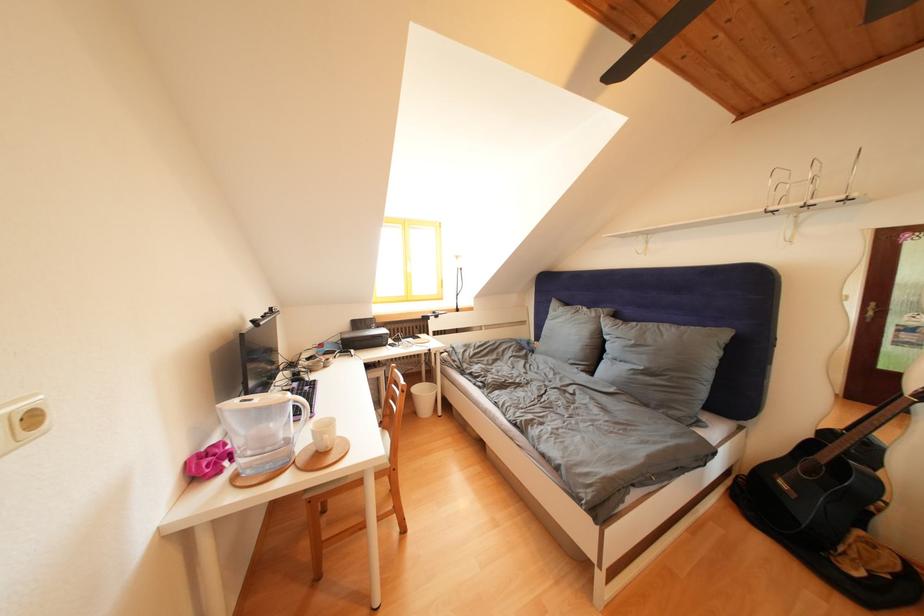
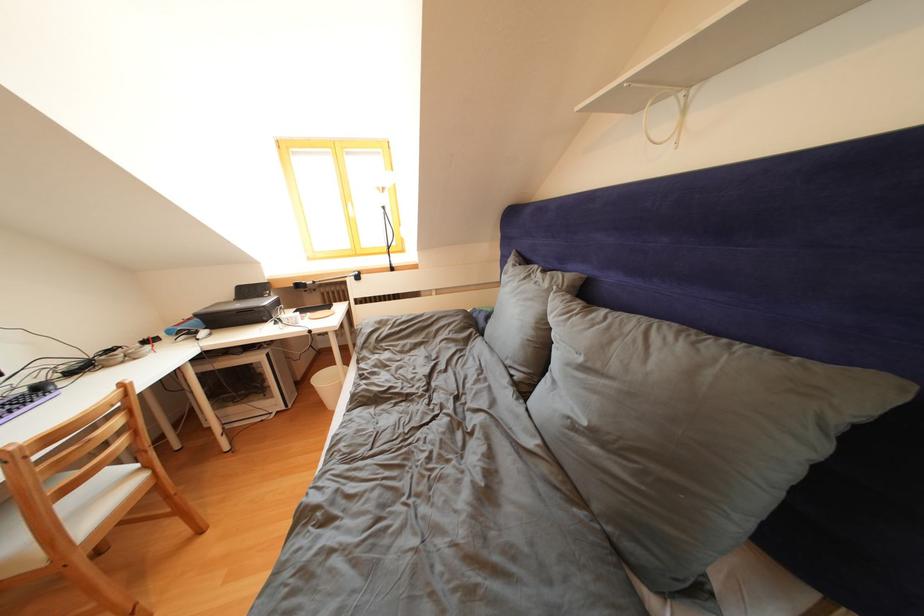
Which direction would the cameraman need to move to produce the second image?

The cameraman moved toward right, forward.